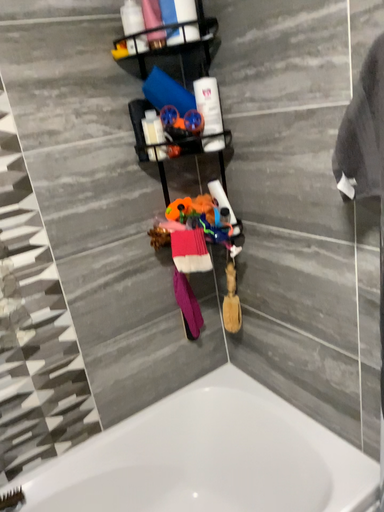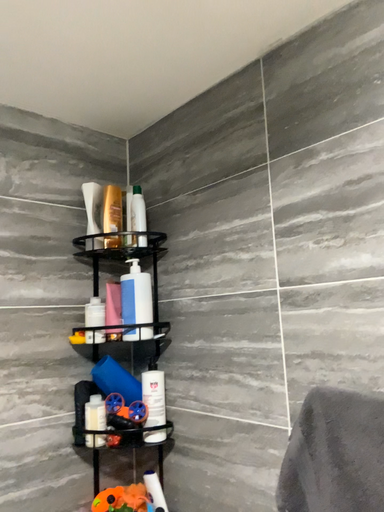
Question: Which way did the camera rotate in the video?

Choices:
 (A) rotated downward
 (B) rotated upward

Answer: (B)